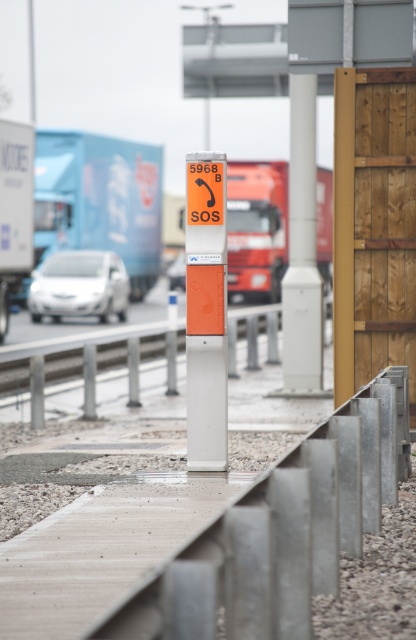
Question: Does orange plastic train track at center have a greater width compared to matte white car at center?

Choices:
 (A) no
 (B) yes

Answer: (B)

Question: Which of the following is the farthest from the observer?

Choices:
 (A) (76, 284)
 (B) (86, 148)
 (C) (207, 371)

Answer: (B)

Question: Does orange matte sign at center appear over white plastic pole at center?

Choices:
 (A) no
 (B) yes

Answer: (A)

Question: Is orange matte sign at center positioned behind orange matte trailer truck at center?

Choices:
 (A) yes
 (B) no

Answer: (B)

Question: Which of the following is the farthest from the observer?

Choices:
 (A) (240, 188)
 (B) (42, 422)

Answer: (A)

Question: Based on their relative distances, which object is nearer to the orange matte trailer truck at center?

Choices:
 (A) white plastic pole at center
 (B) matte white car at center
 (C) orange matte sign at center
 (D) blue matte trailer truck at left

Answer: (B)